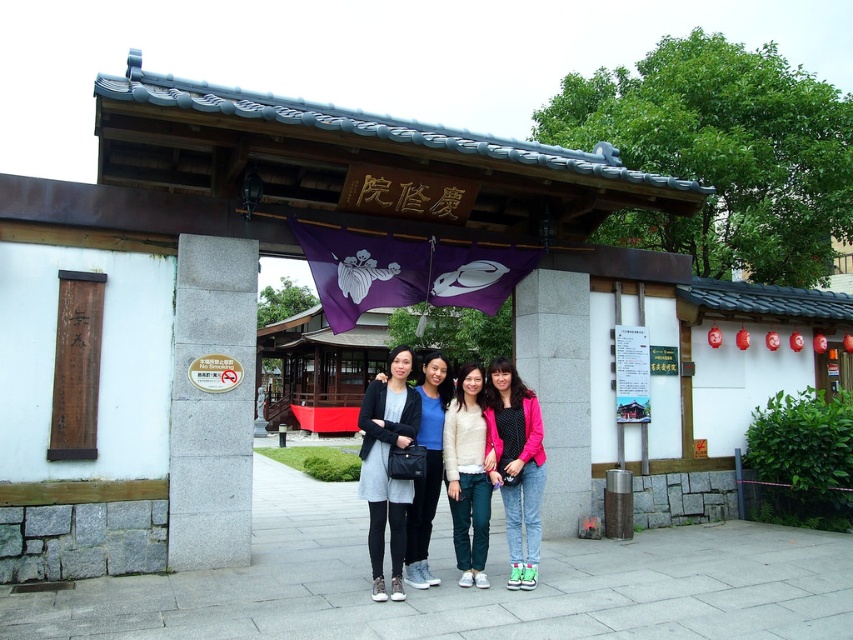
Question: Which object is the closest to the pink fabric jacket at center?

Choices:
 (A) matte black dress at center
 (B) matte black jacket at center
 (C) white cotton sweater at center

Answer: (C)

Question: Which point is farther to the camera?

Choices:
 (A) (538, 540)
 (B) (468, 422)

Answer: (B)

Question: Does matte black dress at center appear on the right side of white cotton sweater at center?

Choices:
 (A) yes
 (B) no

Answer: (B)

Question: Observing the image, what is the correct spatial positioning of matte black dress at center in reference to matte black jacket at center?

Choices:
 (A) right
 (B) left

Answer: (B)

Question: Does pink fabric jacket at center appear on the left side of matte black jacket at center?

Choices:
 (A) no
 (B) yes

Answer: (A)

Question: Among these points, which one is nearest to the camera?

Choices:
 (A) (367, 481)
 (B) (405, 545)

Answer: (A)